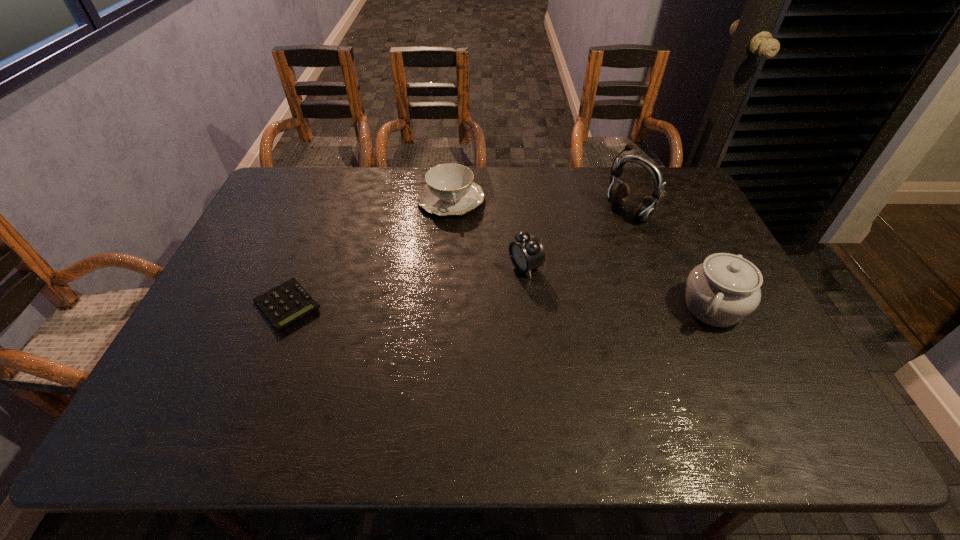
Locate an element on the screen. earphone located in the far edge section of the desktop is located at coordinates point(618,194).

I want to click on chinaware that is positioned at the far edge, so click(x=449, y=190).

The image size is (960, 540). What are the coordinates of `object at the left edge` in the screenshot? It's located at (288, 302).

The height and width of the screenshot is (540, 960). Find the location of `chinaware that is positioned at the right edge`. chinaware that is positioned at the right edge is located at coordinates (725, 289).

Where is `earphone located at the right edge`? Image resolution: width=960 pixels, height=540 pixels. earphone located at the right edge is located at coordinates (618, 194).

I want to click on object positioned at the far right corner, so click(618, 194).

Find the location of a particular element. Image resolution: width=960 pixels, height=540 pixels. vacant space at the far edge of the desktop is located at coordinates (543, 171).

This screenshot has height=540, width=960. Identify the location of free space at the near edge. (718, 389).

At what (x,y) coordinates should I click in order to perform the action: click on free location at the left edge. Please return your answer as a coordinate pair (x, y). The image size is (960, 540). Looking at the image, I should click on (250, 234).

At what (x,y) coordinates should I click in order to perform the action: click on blank area at the far left corner. Please return your answer as a coordinate pair (x, y). Image resolution: width=960 pixels, height=540 pixels. Looking at the image, I should click on (305, 196).